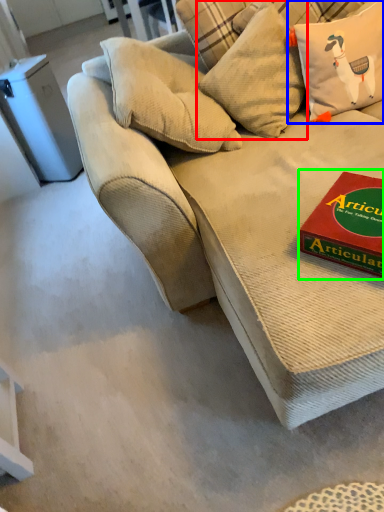
Question: Which object is the closest to the pillow (highlighted by a red box)? Choose among these: pillow (highlighted by a blue box) or paperback book (highlighted by a green box).

Choices:
 (A) pillow
 (B) paperback book

Answer: (A)